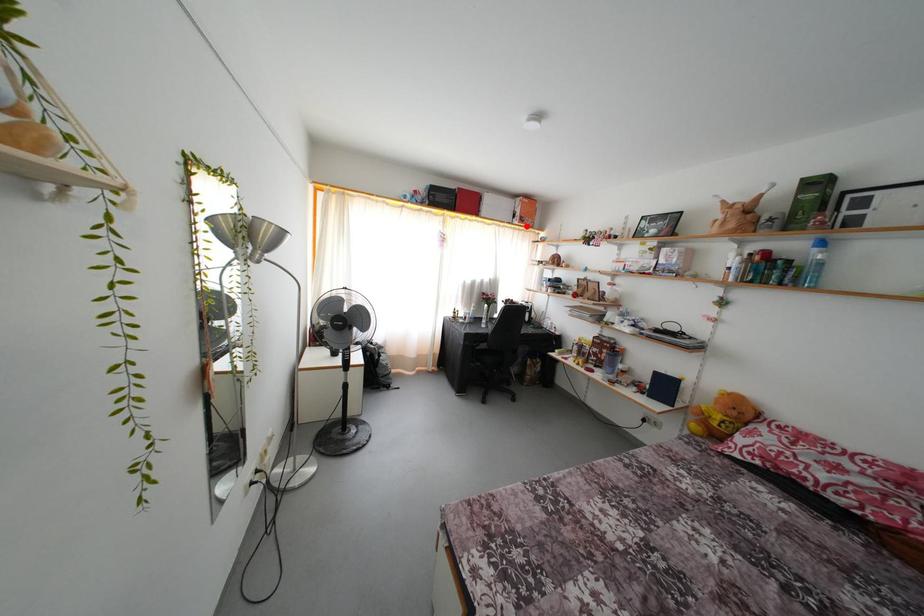
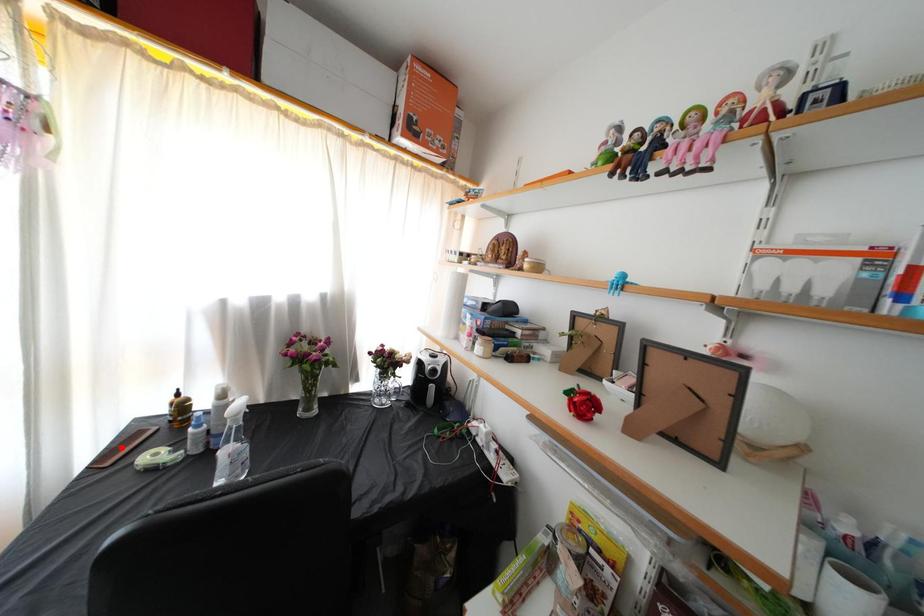
From the picture: I am providing you with two images of the same scene from different viewpoints. A red point is marked on the first image and another point is marked on the second image. Are the points marked in image1 and image2 representing the same 3D position?

No